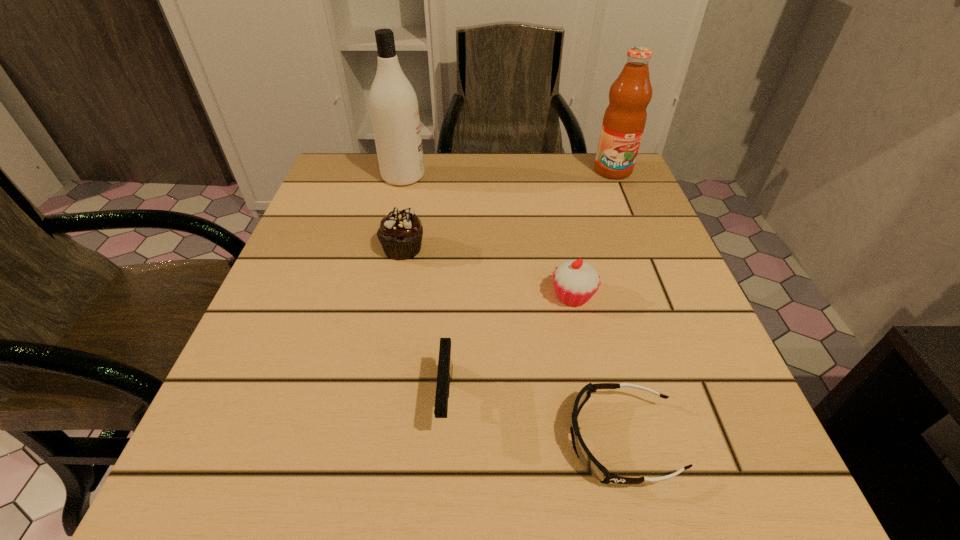
At what (x,y) coordinates should I click in order to perform the action: click on shampoo. Please return your answer as a coordinate pair (x, y). This screenshot has height=540, width=960. Looking at the image, I should click on (393, 103).

This screenshot has width=960, height=540. In order to click on fruit juice in this screenshot , I will do `click(624, 120)`.

What are the coordinates of `the fifth shortest object` in the screenshot? It's located at (624, 120).

I want to click on the left cupcake, so click(x=400, y=234).

You are a GUI agent. You are given a task and a screenshot of the screen. Output one action in this format:
    pyautogui.click(x=<x>, y=<y>)
    Task: Click on the farther cupcake
    Image resolution: width=960 pixels, height=540 pixels.
    Given the screenshot: What is the action you would take?
    pyautogui.click(x=400, y=234)

Identify the location of the nearer cupcake. Image resolution: width=960 pixels, height=540 pixels. (575, 281).

Where is `the right cupcake`? the right cupcake is located at coordinates (575, 281).

Locate an element on the screen. The height and width of the screenshot is (540, 960). pistol is located at coordinates tap(444, 375).

Where is `the shortest object`? Image resolution: width=960 pixels, height=540 pixels. the shortest object is located at coordinates (594, 467).

Image resolution: width=960 pixels, height=540 pixels. What are the coordinates of `vacant space located 0.280m on the front-facing side of the shampoo` in the screenshot? It's located at (541, 177).